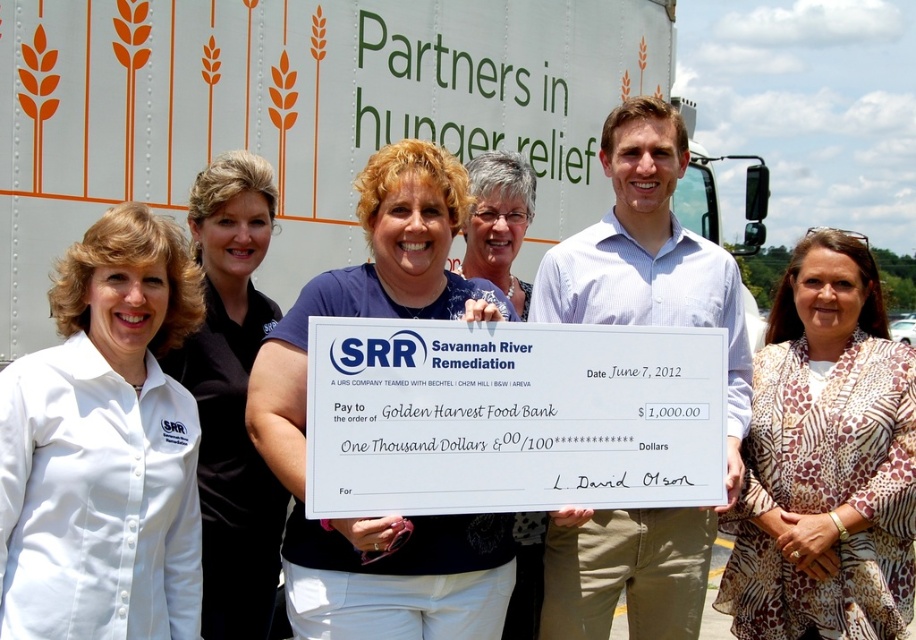
Is white shirt at center above printed fabric blouse at center?

Indeed, white shirt at center is positioned over printed fabric blouse at center.

Image resolution: width=916 pixels, height=640 pixels. What do you see at coordinates (104, 448) in the screenshot?
I see `white shirt at center` at bounding box center [104, 448].

At what (x,y) coordinates should I click in order to perform the action: click on white shirt at center. Please return your answer as a coordinate pair (x, y). Image resolution: width=916 pixels, height=640 pixels. Looking at the image, I should click on (104, 448).

In the scene shown: Between white matte trailer truck at upper center and printed fabric blouse at center, which one has more height?

Standing taller between the two is printed fabric blouse at center.

Measure the distance between point (x=112, y=136) and camera.

Point (x=112, y=136) and camera are 6.34 meters apart.

The image size is (916, 640). What are the coordinates of `white matte trailer truck at upper center` in the screenshot? It's located at (297, 113).

Between white matte trailer truck at upper center and white shirt at center, which one appears on the right side from the viewer's perspective?

From the viewer's perspective, white matte trailer truck at upper center appears more on the right side.

Looking at this image, can you confirm if white matte trailer truck at upper center is wider than white shirt at center?

Yes, white matte trailer truck at upper center is wider than white shirt at center.

Is point (53, 4) in front of point (168, 301)?

No.

Locate an element on the screen. The image size is (916, 640). white matte trailer truck at upper center is located at coordinates (297, 113).